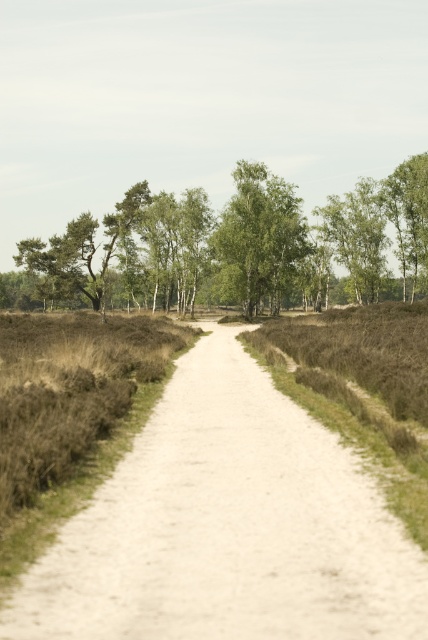
Question: Does white gravel path at center come behind green leafy tree at center?

Choices:
 (A) no
 (B) yes

Answer: (A)

Question: Is white gravel path at center further to camera compared to green leafy tree at center?

Choices:
 (A) no
 (B) yes

Answer: (A)

Question: Which object is closer to the camera taking this photo?

Choices:
 (A) green leafy tree at upper center
 (B) green leafy tree at center
 (C) white gravel path at center

Answer: (C)

Question: Is white gravel path at center positioned behind green leafy tree at upper center?

Choices:
 (A) no
 (B) yes

Answer: (A)

Question: Which point is farther to the camera?

Choices:
 (A) (360, 284)
 (B) (109, 620)

Answer: (A)

Question: Which point appears farthest from the camera in this image?

Choices:
 (A) (374, 586)
 (B) (372, 300)
 (C) (249, 186)

Answer: (B)